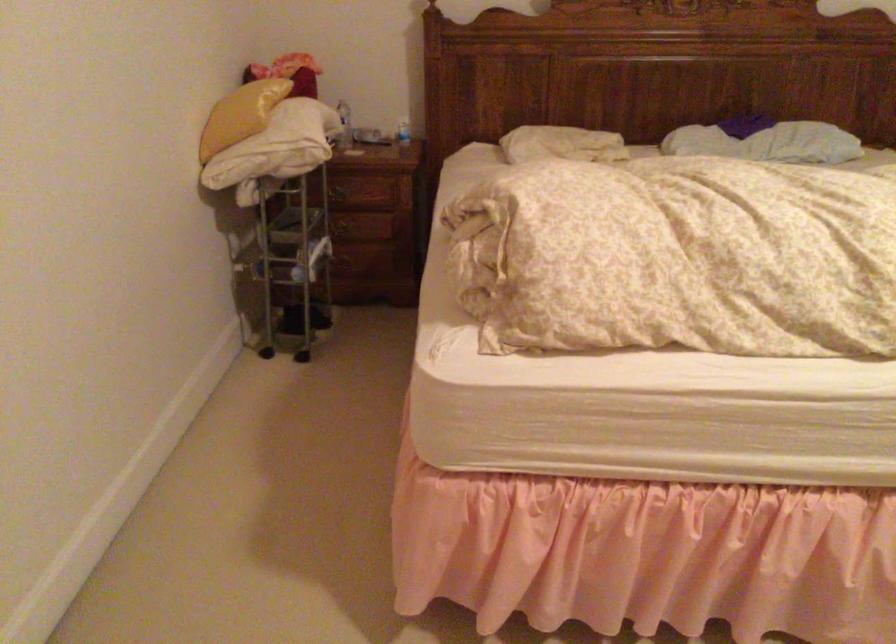
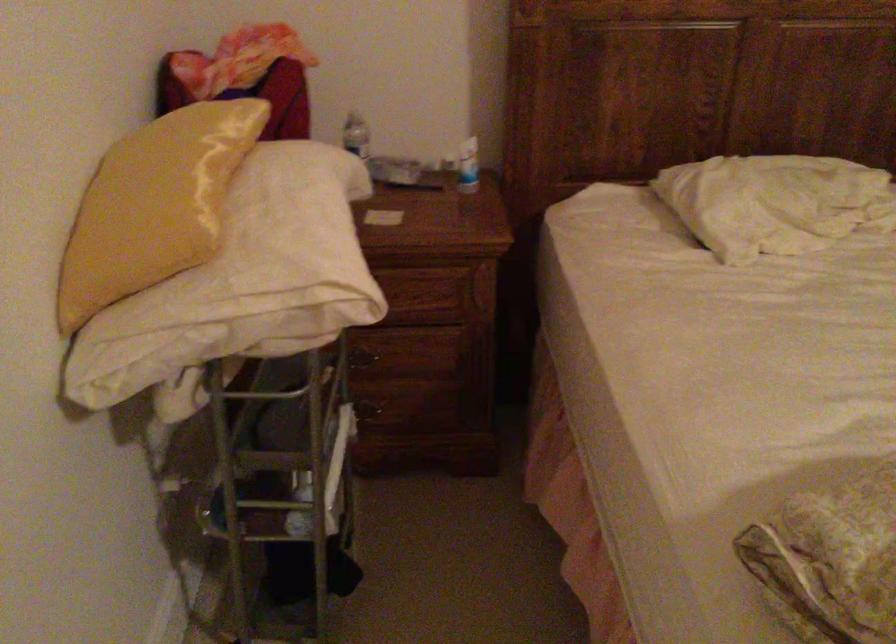
Question: What movement of the cameraman would produce the second image?

Choices:
 (A) Left
 (B) Right
 (C) Forward
 (D) Backward

Answer: (C)